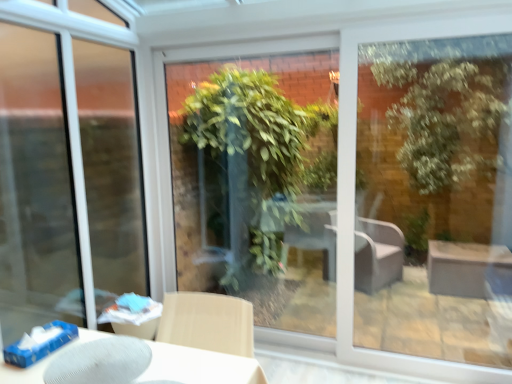
Identify the location of vacant area on top of white textured plate at lower left (from a real-world perspective). (93, 357).